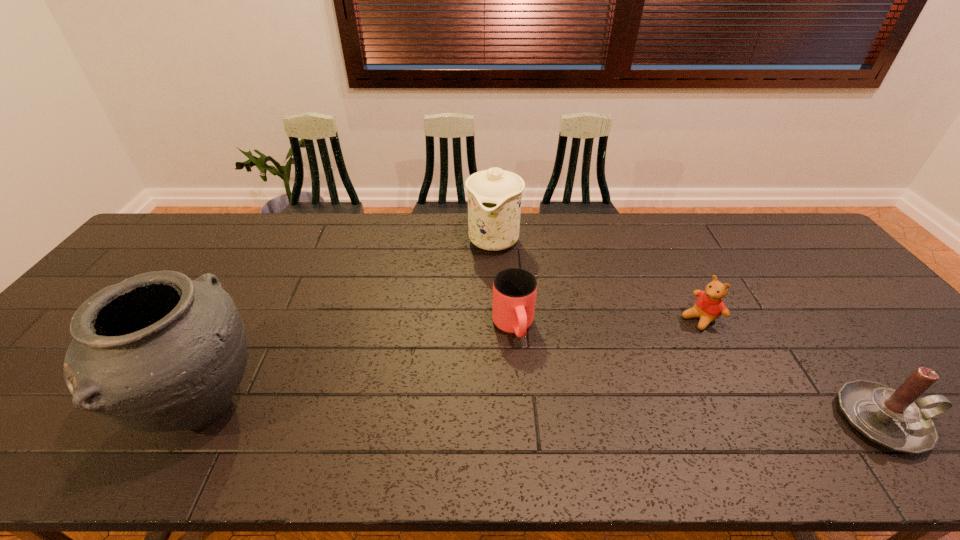
Locate an element on the screen. The height and width of the screenshot is (540, 960). the tallest object is located at coordinates (158, 352).

Find the location of a particular element. The image size is (960, 540). urn is located at coordinates (158, 352).

You are a GUI agent. You are given a task and a screenshot of the screen. Output one action in this format:
    pyautogui.click(x=<x>, y=<y>)
    Task: Click on the cup
    The image size is (960, 540).
    Given the screenshot: What is the action you would take?
    pyautogui.click(x=514, y=290)

The height and width of the screenshot is (540, 960). Find the location of `the farthest object`. the farthest object is located at coordinates (494, 196).

What are the coordinates of `chinaware` in the screenshot? It's located at (494, 196).

Image resolution: width=960 pixels, height=540 pixels. Find the location of `the second object from right to left`. the second object from right to left is located at coordinates tap(709, 306).

The height and width of the screenshot is (540, 960). What are the coordinates of `vacant area located on the left of the tallest object` in the screenshot? It's located at (36, 407).

This screenshot has height=540, width=960. In order to click on vacant position located 0.180m on the handle side of the cup in this screenshot , I will do `click(537, 412)`.

At what (x,y) coordinates should I click in order to perform the action: click on free space located on the handle side of the cup. Please return your answer as a coordinate pair (x, y). This screenshot has width=960, height=540. Looking at the image, I should click on [x=529, y=386].

The height and width of the screenshot is (540, 960). I want to click on vacant space located on the handle side of the cup, so click(x=532, y=393).